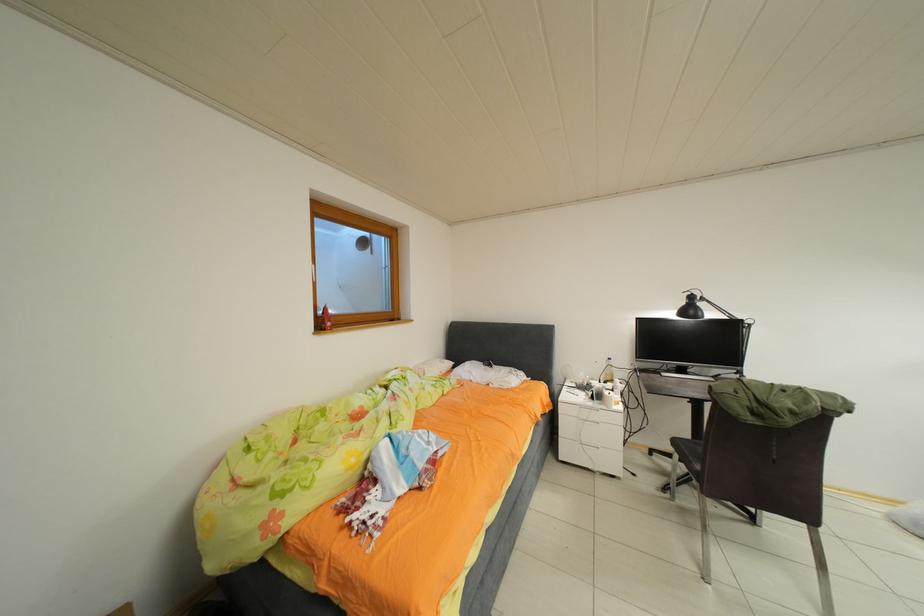
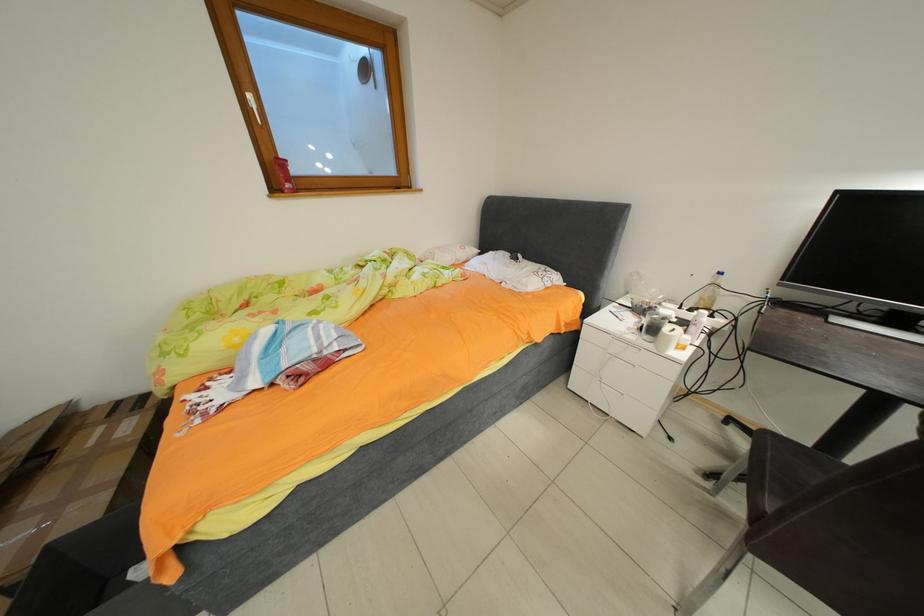
How did the camera likely rotate?

The rotation direction of the camera is left-down.